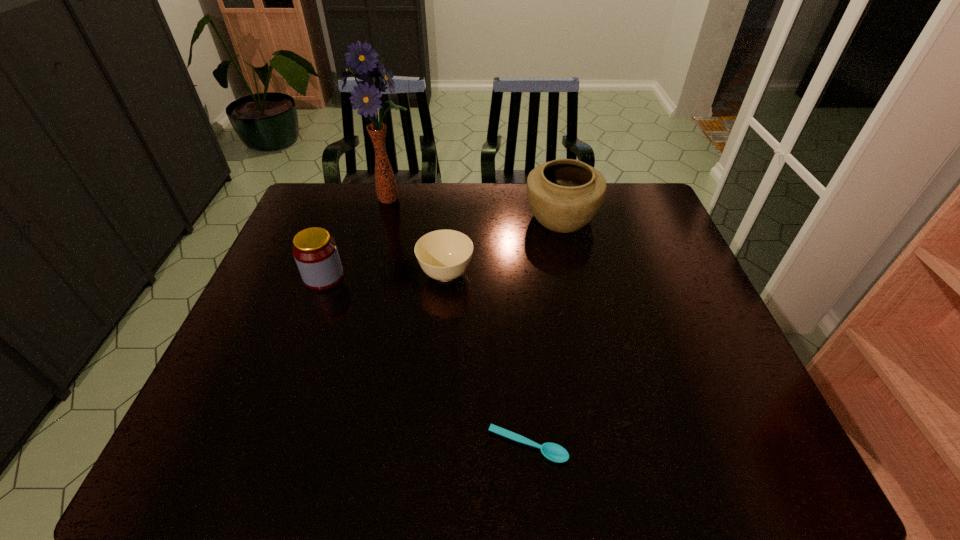
At what (x,y) coordinates should I click in order to perform the action: click on vacant space that is in between the third object from right to left and the nearest object. Please return your answer as a coordinate pair (x, y). Image resolution: width=960 pixels, height=540 pixels. Looking at the image, I should click on (487, 360).

Locate which object is the second closest to the fourth shortest object. Please provide its 2D coordinates. Your answer should be formatted as a tuple, i.e. [(x, y)], where the tuple contains the x and y coordinates of a point satisfying the conditions above.

[(365, 97)]

Where is `the second closest object relative to the second tallest object`? This screenshot has width=960, height=540. the second closest object relative to the second tallest object is located at coordinates (365, 97).

The image size is (960, 540). I want to click on free space that satisfies the following two spatial constraints: 1. on the front side of the fourth tallest object; 2. on the right side of the shortest object, so click(x=432, y=446).